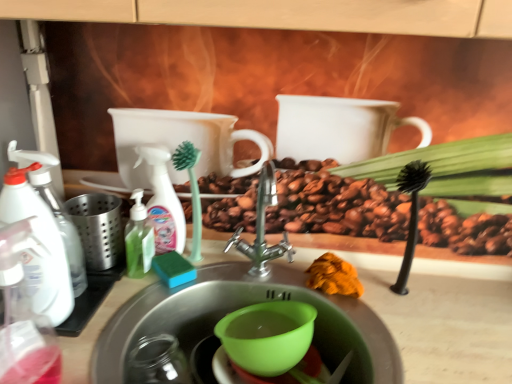
Locate an element on the screen. green plastic spray bottle at center, the 1th cleaning product from the right is located at coordinates (163, 201).

What is the approximate height of black plastic brush at right, the 2th plant in the left-to-right sequence?

10.77 inches.

This screenshot has width=512, height=384. What do you see at coordinates (41, 244) in the screenshot?
I see `white plastic spray bottle at left, which appears as the 1th cleaning product when viewed from the left` at bounding box center [41, 244].

The height and width of the screenshot is (384, 512). I want to click on orange fabric at sink, so click(334, 276).

You are a GUI agent. You are given a task and a screenshot of the screen. Output one action in this format:
    pyautogui.click(x=<x>, y=<y>)
    Task: Click on the green plastic spray bottle at center, the 1th cleaning product from the right
    The height and width of the screenshot is (384, 512).
    Given the screenshot: What is the action you would take?
    pyautogui.click(x=163, y=201)

At what (x,y) coordinates should I click in order to perform the action: click on mixing bowl located below the green plastic spray bottle at center, positioned as the third cleaning product in left-to-right order (from the image's perspective). Please return your answer as a coordinate pair (x, y). Image resolution: width=512 pixels, height=384 pixels. Looking at the image, I should click on (267, 336).

Who is taller, green plastic spray bottle at center, positioned as the third cleaning product in left-to-right order, or green plastic bowl at sink?

green plastic spray bottle at center, positioned as the third cleaning product in left-to-right order, is taller.

Looking at their sizes, would you say green plastic spray bottle at center, the 1th cleaning product from the right, is wider or thinner than green plastic bowl at sink?

Considering their sizes, green plastic spray bottle at center, the 1th cleaning product from the right, looks slimmer than green plastic bowl at sink.

Which is farther, (178,242) or (251,340)?

The point (178,242) is farther.

Consider the image. Between orange fabric at sink and green plastic scrub brush at center, the second plant from the right, which one has larger width?

orange fabric at sink.

In the image, is orange fabric at sink positioned in front of or behind green plastic scrub brush at center, positioned as the 1th plant in left-to-right order?

orange fabric at sink is positioned closer to the viewer than green plastic scrub brush at center, positioned as the 1th plant in left-to-right order.

Would you say orange fabric at sink is a long distance from green plastic scrub brush at center, the second plant from the right?

They are positioned close to each other.

Considering the sizes of objects green plastic bowl at center and green plastic spray bottle at center, the 1th cleaning product from the right, in the image provided, who is wider, green plastic bowl at center or green plastic spray bottle at center, the 1th cleaning product from the right,?

With larger width is green plastic bowl at center.

In order to click on the 2nd cleaning product above the green plastic bowl at center (from a real-world perspective) in this screenshot , I will do `click(163, 201)`.

Considering the positions of objects green plastic bowl at center and green plastic spray bottle at center, positioned as the third cleaning product in left-to-right order, in the image provided, who is behind, green plastic bowl at center or green plastic spray bottle at center, positioned as the third cleaning product in left-to-right order,?

green plastic spray bottle at center, positioned as the third cleaning product in left-to-right order, is behind.

Considering the positions of objects green plastic bowl at center and green plastic spray bottle at center, the 1th cleaning product from the right, in the image provided, who is more to the right, green plastic bowl at center or green plastic spray bottle at center, the 1th cleaning product from the right,?

Positioned to the right is green plastic bowl at center.

Who is bigger, green translucent pump bottle at left, placed as the 2th cleaning product when sorted from right to left, or green plastic bowl at sink?

Bigger between the two is green plastic bowl at sink.

Are green translucent pump bottle at left, which is the second cleaning product in left-to-right order, and green plastic bowl at sink making contact?

No.

How distant is green translucent pump bottle at left, which is the second cleaning product in left-to-right order, from green plastic bowl at sink?

A distance of 10.92 inches exists between green translucent pump bottle at left, which is the second cleaning product in left-to-right order, and green plastic bowl at sink.

Considering the relative positions of green translucent pump bottle at left, placed as the 2th cleaning product when sorted from right to left, and green plastic bowl at sink in the image provided, is green translucent pump bottle at left, placed as the 2th cleaning product when sorted from right to left, in front of green plastic bowl at sink?

No.

Is green plastic bowl at sink oriented away from black plastic brush at right, which is counted as the first plant, starting from the right?

No, green plastic bowl at sink's orientation is not away from black plastic brush at right, which is counted as the first plant, starting from the right.

Is green plastic bowl at sink thinner than black plastic brush at right, the 2th plant in the left-to-right sequence?

Incorrect, the width of green plastic bowl at sink is not less than that of black plastic brush at right, the 2th plant in the left-to-right sequence.

Between green plastic bowl at sink and black plastic brush at right, which is counted as the first plant, starting from the right, which one has smaller size?

black plastic brush at right, which is counted as the first plant, starting from the right.

Consider the image. From a real-world perspective, who is located lower, green plastic bowl at sink or black plastic brush at right, the 2th plant in the left-to-right sequence?

green plastic bowl at sink.

Does point (139, 267) come farther from viewer compared to point (408, 189)?

No, (139, 267) is in front of (408, 189).

Which is more to the right, green translucent pump bottle at left, placed as the 2th cleaning product when sorted from right to left, or black plastic brush at right, which is counted as the first plant, starting from the right?

Positioned to the right is black plastic brush at right, which is counted as the first plant, starting from the right.

Is green translucent pump bottle at left, placed as the 2th cleaning product when sorted from right to left, facing away from black plastic brush at right, which is counted as the first plant, starting from the right?

No.

Between green plastic spray bottle at center, the 1th cleaning product from the right, and white plastic spray bottle at left, the 3th cleaning product from the right, which one has smaller width?

green plastic spray bottle at center, the 1th cleaning product from the right.

From a real-world perspective, is green plastic spray bottle at center, positioned as the third cleaning product in left-to-right order, positioned above or below white plastic spray bottle at left, the 3th cleaning product from the right?

Clearly, from a real-world perspective, green plastic spray bottle at center, positioned as the third cleaning product in left-to-right order, is below white plastic spray bottle at left, the 3th cleaning product from the right.

Between green plastic spray bottle at center, the 1th cleaning product from the right, and white plastic spray bottle at left, which appears as the 1th cleaning product when viewed from the left, which one has smaller size?

With smaller size is green plastic spray bottle at center, the 1th cleaning product from the right.

Where is `the 3rd cleaning product above the green plastic bowl at sink (from the image's perspective)`? the 3rd cleaning product above the green plastic bowl at sink (from the image's perspective) is located at coordinates (163, 201).

Where is `food below the green plastic scrub brush at center, the second plant from the right (from the image's perspective)`? Image resolution: width=512 pixels, height=384 pixels. food below the green plastic scrub brush at center, the second plant from the right (from the image's perspective) is located at coordinates pyautogui.click(x=334, y=276).

Considering their positions, is green translucent pump bottle at left, placed as the 2th cleaning product when sorted from right to left, positioned closer to green plastic spray bottle at center, positioned as the third cleaning product in left-to-right order, than orange fabric at sink?

Based on the image, green translucent pump bottle at left, placed as the 2th cleaning product when sorted from right to left, appears to be nearer to green plastic spray bottle at center, positioned as the third cleaning product in left-to-right order.

Which object lies further to the anchor point white plastic spray bottle at left, which appears as the 1th cleaning product when viewed from the left, green plastic bowl at center or orange fabric at sink?

Based on the image, orange fabric at sink appears to be further to white plastic spray bottle at left, which appears as the 1th cleaning product when viewed from the left.

Estimate the real-world distances between objects in this image. Which object is further from green plastic scrub brush at center, positioned as the 1th plant in left-to-right order, green translucent pump bottle at left, which is the second cleaning product in left-to-right order, or green plastic bowl at center?

Among the two, green plastic bowl at center is located further to green plastic scrub brush at center, positioned as the 1th plant in left-to-right order.

Considering their positions, is white plastic spray bottle at left, the 3th cleaning product from the right, positioned further to green translucent pump bottle at left, which is the second cleaning product in left-to-right order, than black plastic brush at right, which is counted as the first plant, starting from the right?

The object further to green translucent pump bottle at left, which is the second cleaning product in left-to-right order, is black plastic brush at right, which is counted as the first plant, starting from the right.

Which object lies further to the anchor point green plastic scrub brush at center, the second plant from the right, white plastic spray bottle at left, the 3th cleaning product from the right, or orange fabric at sink?

orange fabric at sink.

Considering their positions, is black plastic brush at right, the 2th plant in the left-to-right sequence, positioned further to green plastic spray bottle at center, positioned as the third cleaning product in left-to-right order, than green translucent pump bottle at left, placed as the 2th cleaning product when sorted from right to left?

black plastic brush at right, the 2th plant in the left-to-right sequence, lies further to green plastic spray bottle at center, positioned as the third cleaning product in left-to-right order, than the other object.

Estimate the real-world distances between objects in this image. Which object is closer to black plastic brush at right, which is counted as the first plant, starting from the right, green plastic bowl at sink or green plastic bowl at center?

Among the two, green plastic bowl at sink is located nearer to black plastic brush at right, which is counted as the first plant, starting from the right.

Consider the image. Which object lies further to the anchor point green plastic scrub brush at center, positioned as the 1th plant in left-to-right order, orange fabric at sink or black plastic brush at right, which is counted as the first plant, starting from the right?

Based on the image, black plastic brush at right, which is counted as the first plant, starting from the right, appears to be further to green plastic scrub brush at center, positioned as the 1th plant in left-to-right order.

Where is `sink between white plastic spray bottle at left, the 3th cleaning product from the right, and black plastic brush at right, the 2th plant in the left-to-right sequence, from left to right`? The height and width of the screenshot is (384, 512). sink between white plastic spray bottle at left, the 3th cleaning product from the right, and black plastic brush at right, the 2th plant in the left-to-right sequence, from left to right is located at coordinates (237, 309).

Where is `sink located between green translucent pump bottle at left, placed as the 2th cleaning product when sorted from right to left, and green plastic bowl at sink in the left-right direction`? The width and height of the screenshot is (512, 384). sink located between green translucent pump bottle at left, placed as the 2th cleaning product when sorted from right to left, and green plastic bowl at sink in the left-right direction is located at coordinates (237, 309).

Where is `plant between green plastic spray bottle at center, the 1th cleaning product from the right, and orange fabric at sink from left to right`? plant between green plastic spray bottle at center, the 1th cleaning product from the right, and orange fabric at sink from left to right is located at coordinates (191, 191).

The height and width of the screenshot is (384, 512). I want to click on mixing bowl situated between green plastic scrub brush at center, the second plant from the right, and orange fabric at sink from left to right, so click(x=267, y=336).